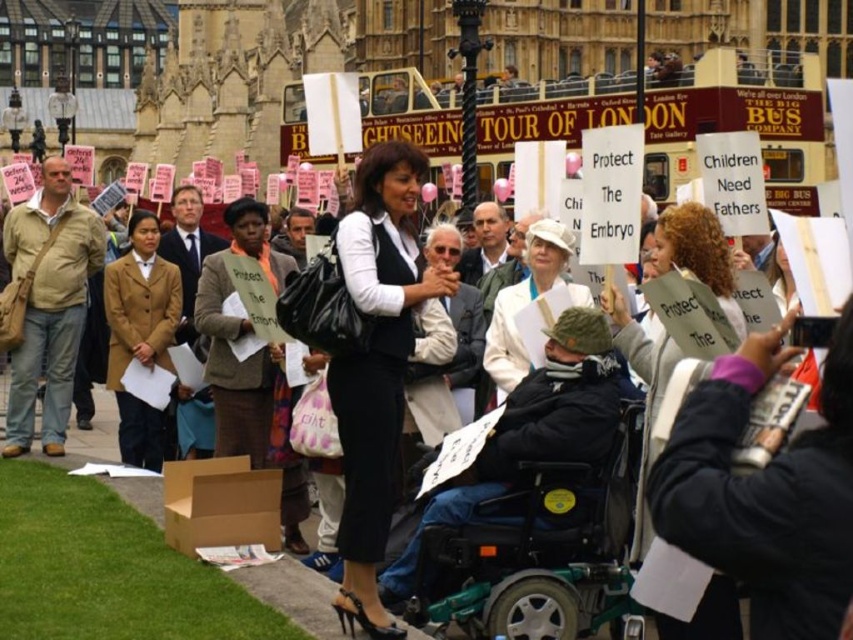
You are a photographer at the protest scene. You want to capture a photo of the matte black vest at center without any obstructions. Based on the coordinates provided, is there any object overlapping with the vest at point (376, 365)?

The matte black vest at center is represented by point (376, 365), so there are no obstructions overlapping with it at that coordinate.